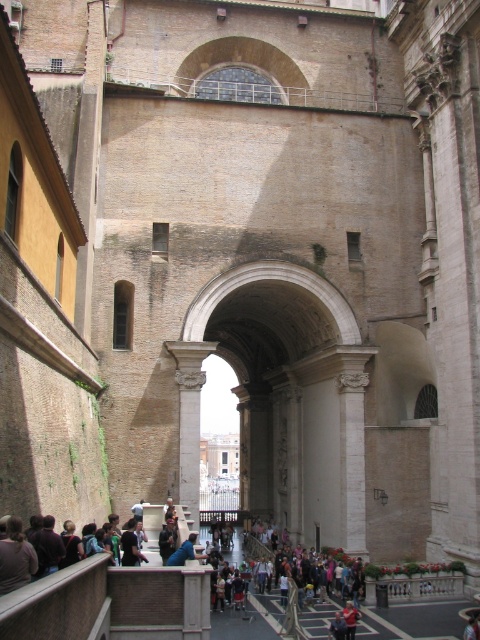
Question: Among these points, which one is farthest from the camera?

Choices:
 (A) (476, 621)
 (B) (195, 534)

Answer: (B)

Question: From the image, what is the correct spatial relationship of blue denim jeans at center in relation to dark blue fabric at center?

Choices:
 (A) right
 (B) left

Answer: (B)

Question: Considering the relative positions of blue denim jeans at center and dark blue fabric at center in the image provided, where is blue denim jeans at center located with respect to dark blue fabric at center?

Choices:
 (A) right
 (B) left

Answer: (B)

Question: Which point appears closest to the camera in this image?

Choices:
 (A) (471, 625)
 (B) (188, 545)

Answer: (A)

Question: Does blue denim jeans at center appear under dark blue fabric at center?

Choices:
 (A) no
 (B) yes

Answer: (A)